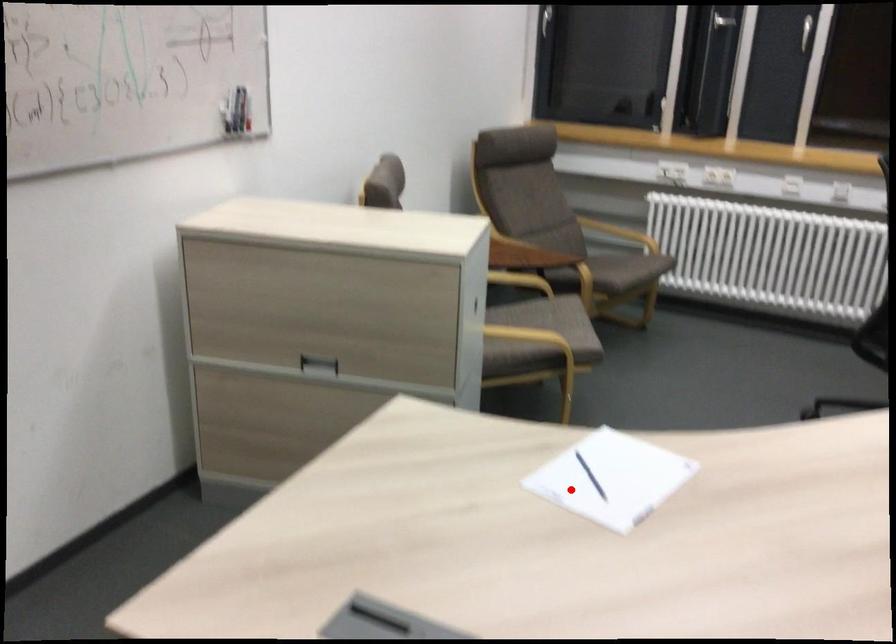
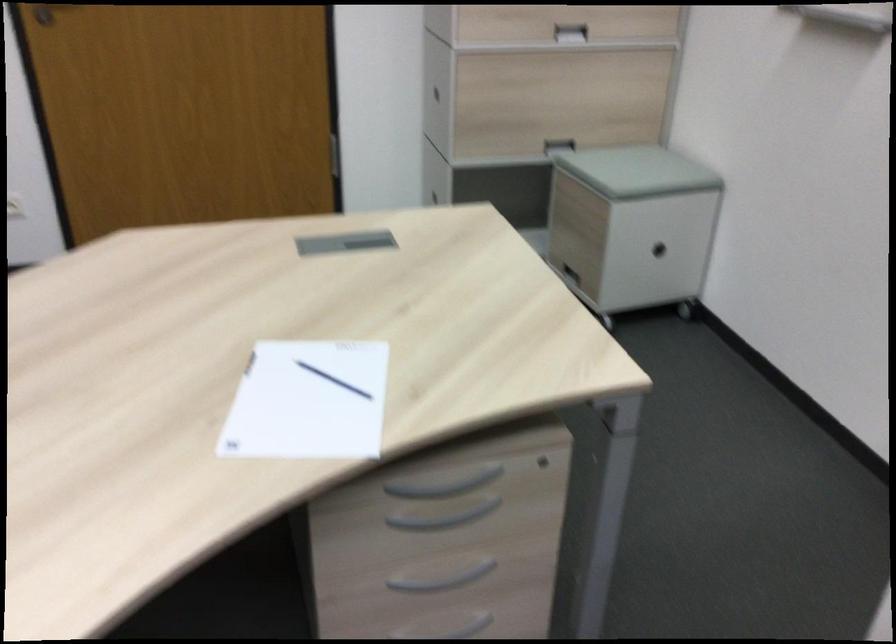
Find the pixel in the second image that matches the highlighted location in the first image.

(333, 380)